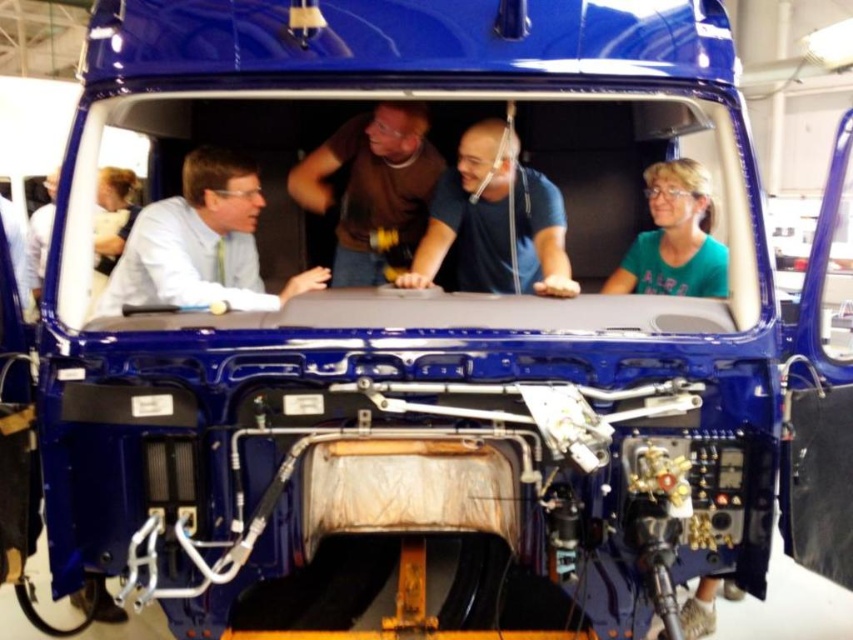
You are a maintenance technician standing between the matte white shirt at left and brown cotton shirt at center. The safety protocol requires you to maintain a minimum distance of 24 inches between yourself and any bystanders. Can you safely stand exactly halfway between them without violating the protocol?

The distance between the matte white shirt at left and brown cotton shirt at center is 24.53 inches. If you stand exactly halfway, you would be 12.265 inches away from each, which is within the required 24 inches minimum distance. Therefore, it is safe to stand halfway without violating the protocol.

You are standing outside the truck cab and want to identify which person is more visible to you between the blue cotton shirt at center and the green matte shirt at center. Which one would you see first?

The blue cotton shirt at center is closer to the viewer than the green matte shirt at center, so you would see the blue cotton shirt at center first.

You are a safety inspector in this scene. You need to ensure that the distance between the matte white shirt at left and the brown cotton shirt at center is at least 1 meter for safety regulations. Can you confirm if they are compliant?

The matte white shirt at left might be wider than brown cotton shirt at center, but the description does not specify the distance between them. Therefore, it is unclear if they meet the 1 meter requirement.